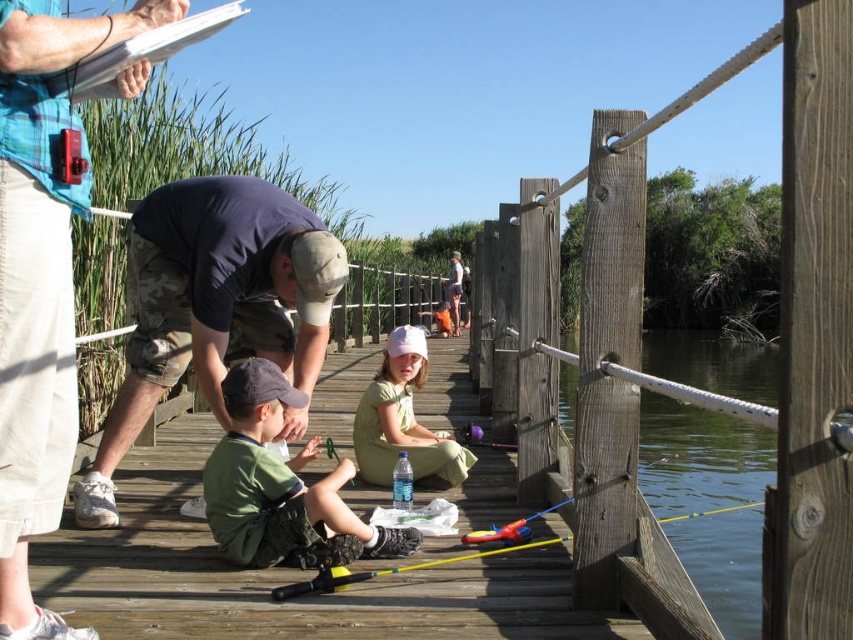
Which is below, dark blue/camo pants at center or green matte shirt at center?

green matte shirt at center is below.

Can you confirm if dark blue/camo pants at center is thinner than green matte shirt at center?

No, dark blue/camo pants at center is not thinner than green matte shirt at center.

Describe the element at coordinates (213, 304) in the screenshot. I see `dark blue/camo pants at center` at that location.

Locate an element on the screen. dark blue/camo pants at center is located at coordinates (213, 304).

Who is more distant from viewer, (x=273, y=220) or (x=688, y=468)?

The point (x=688, y=468) is behind.

Image resolution: width=853 pixels, height=640 pixels. I want to click on dark blue/camo pants at center, so click(x=213, y=304).

Can you confirm if green matte shirt at center is positioned below clear water at post right?

Actually, green matte shirt at center is above clear water at post right.

Who is lower down, green matte shirt at center or clear water at post right?

clear water at post right

Identify the location of green matte shirt at center. (281, 486).